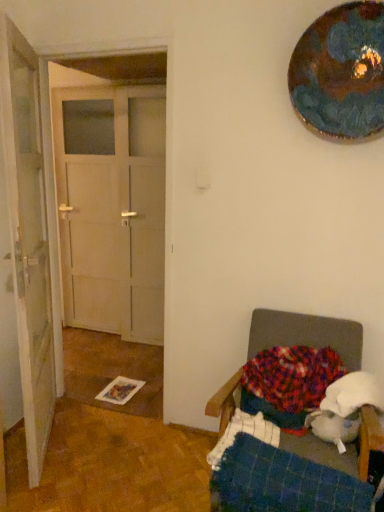
Question: Is metallic reflective plate at upper right completely or partially inside white wooden door at left, the second door in the right-to-left sequence?

Choices:
 (A) yes
 (B) no

Answer: (B)

Question: Is white wooden door at left, the second door in the right-to-left sequence, looking in the opposite direction of metallic reflective plate at upper right?

Choices:
 (A) no
 (B) yes

Answer: (A)

Question: From a real-world perspective, is white wooden door at left, acting as the 1th door starting from the left, physically above metallic reflective plate at upper right?

Choices:
 (A) no
 (B) yes

Answer: (A)

Question: From a real-world perspective, is white wooden door at left, the second door in the right-to-left sequence, physically below metallic reflective plate at upper right?

Choices:
 (A) no
 (B) yes

Answer: (B)

Question: Is the depth of white wooden door at left, the second door in the right-to-left sequence, less than that of metallic reflective plate at upper right?

Choices:
 (A) yes
 (B) no

Answer: (A)

Question: Is white matte door at left, which is the 1th door from right to left, taller or shorter than metallic reflective plate at upper right?

Choices:
 (A) tall
 (B) short

Answer: (A)

Question: From a real-world perspective, is white matte door at left, which is the 1th door from right to left, positioned above or below metallic reflective plate at upper right?

Choices:
 (A) above
 (B) below

Answer: (B)

Question: Considering the relative positions of white matte door at left, which is the 1th door from right to left, and metallic reflective plate at upper right in the image provided, is white matte door at left, which is the 1th door from right to left, to the left or to the right of metallic reflective plate at upper right?

Choices:
 (A) right
 (B) left

Answer: (B)

Question: Is white matte door at left, which is the 1th door from right to left, inside or outside of metallic reflective plate at upper right?

Choices:
 (A) outside
 (B) inside

Answer: (A)

Question: Is multicolored knitted blanket at lower right to the left or to the right of blue plaid blanket at lower right in the image?

Choices:
 (A) right
 (B) left

Answer: (A)

Question: From a real-world perspective, is multicolored knitted blanket at lower right above or below blue plaid blanket at lower right?

Choices:
 (A) below
 (B) above

Answer: (B)

Question: Is point tap(319, 371) closer or farther from the camera than point tap(264, 425)?

Choices:
 (A) farther
 (B) closer

Answer: (A)

Question: Is multicolored knitted blanket at lower right spatially inside blue plaid blanket at lower right, or outside of it?

Choices:
 (A) outside
 (B) inside

Answer: (A)

Question: In terms of height, does multicolored knitted blanket at lower right look taller or shorter compared to white matte door at left, the second door viewed from the left?

Choices:
 (A) short
 (B) tall

Answer: (A)

Question: From a real-world perspective, relative to white matte door at left, the second door viewed from the left, is multicolored knitted blanket at lower right vertically above or below?

Choices:
 (A) below
 (B) above

Answer: (A)